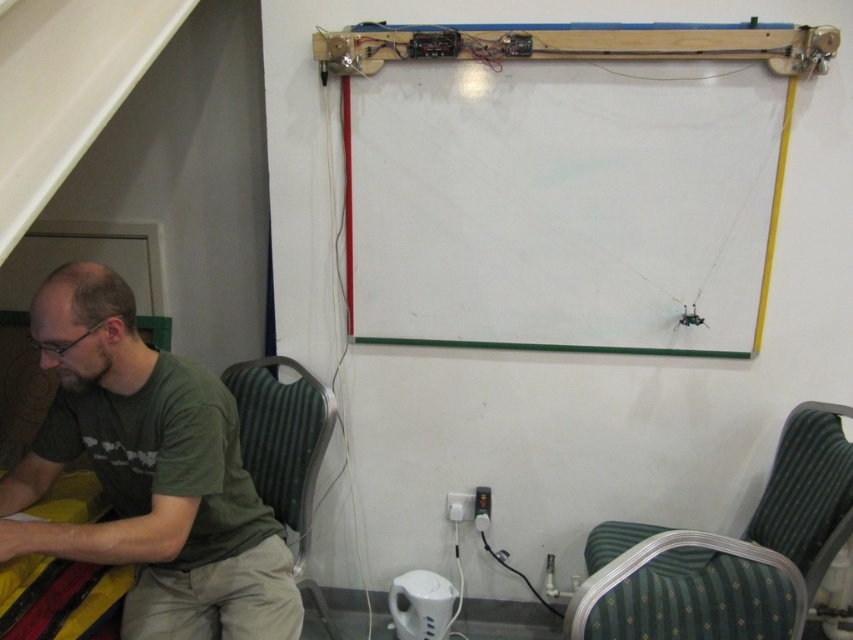
You are standing in the room and notice two points marked on the wall. The first point is at coordinates point (821, 445) and the second is at point (297, 524). Which point is closer to you?

Point (821, 445) is closer to the viewer than point (297, 524).

You are designing a new layout for the room and need to place a rectangular table between the green cotton shirt at lower left and the green fabric chair at lower right. Given their sizes, which object requires more horizontal space?

The green cotton shirt at lower left requires more horizontal space because its width is larger than that of the green fabric chair at lower right.

You are a guest in the room and want to sit as comfortably as possible. Which chair should you choose between the green fabric chair at lower right and the green fabric chair at lower left?

The green fabric chair at lower right is larger in size than the green fabric chair at lower left, so it is more comfortable to sit on the green fabric chair at lower right.